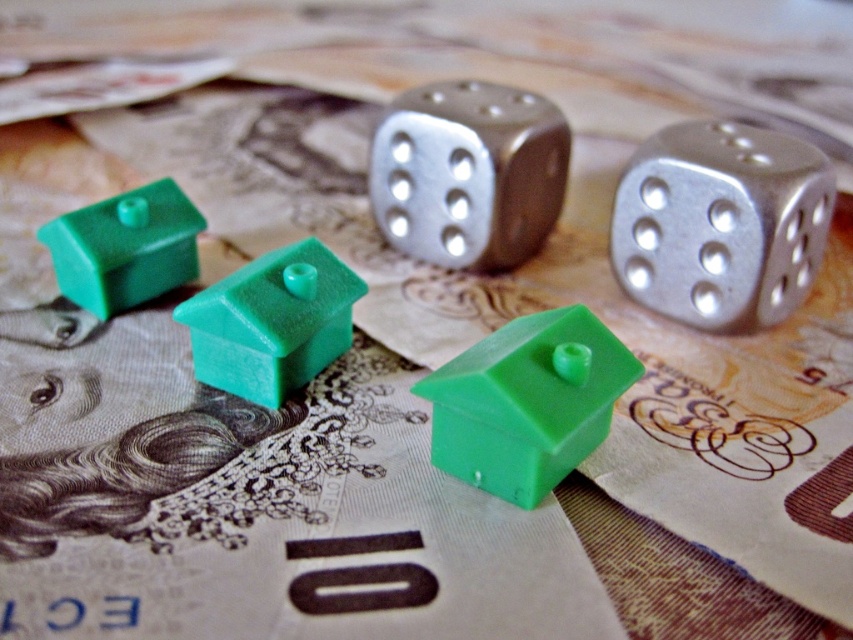
Question: Observing the image, what is the correct spatial positioning of green plastic house at center in reference to green matte house at center?

Choices:
 (A) above
 (B) below

Answer: (B)

Question: Is metallic silver dice at center bigger than green plastic house at center?

Choices:
 (A) no
 (B) yes

Answer: (B)

Question: Which of the following is the farthest from the observer?

Choices:
 (A) green matte house at center
 (B) green plastic house at upper left
 (C) silver metallic dice at upper center
 (D) green plastic house at center

Answer: (B)

Question: Which object appears closest to the camera in this image?

Choices:
 (A) green plastic house at upper left
 (B) green matte house at center
 (C) metallic silver dice at center

Answer: (B)

Question: Which point is farther to the camera?

Choices:
 (A) green plastic house at upper left
 (B) metallic silver dice at center
 (C) green matte house at center
 (D) green plastic house at center

Answer: (B)

Question: Is metallic silver dice at center to the left of green plastic house at center from the viewer's perspective?

Choices:
 (A) no
 (B) yes

Answer: (B)